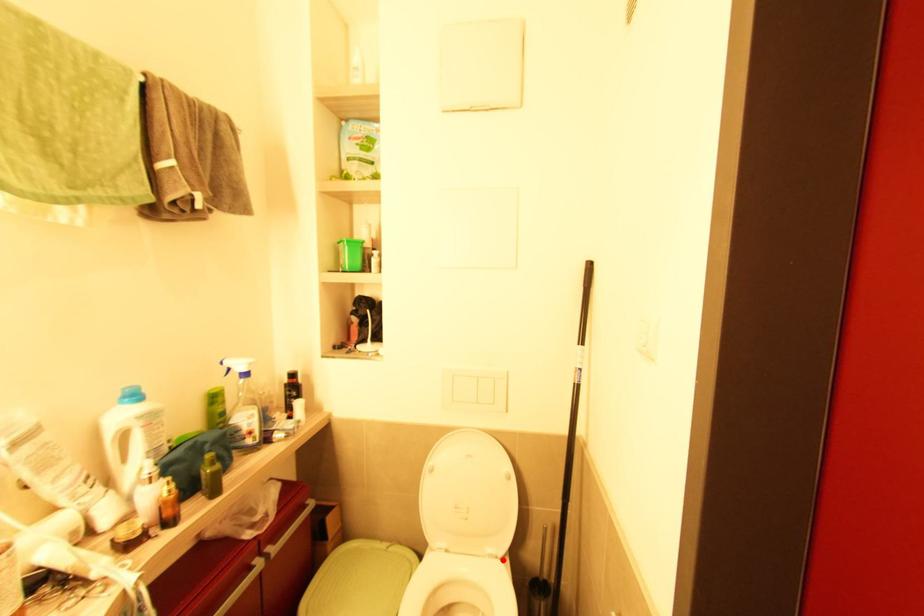
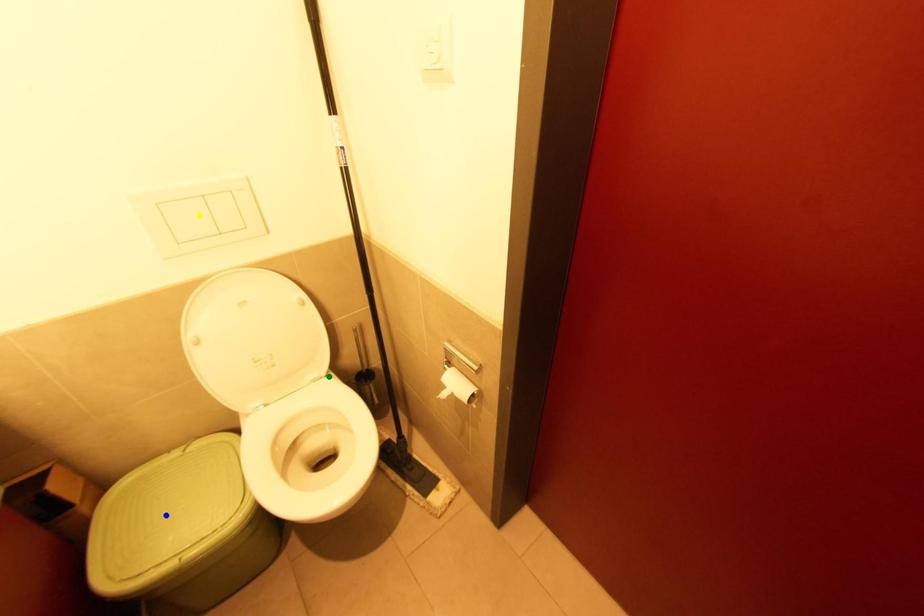
Question: I am providing you with two images of the same scene from different viewpoints. A red point is marked on the first image. You are given multiple points on the second image. Can you choose the point in image 2 that corresponds to the point in image 1?

Choices:
 (A) blue point
 (B) yellow point
 (C) green point

Answer: (C)